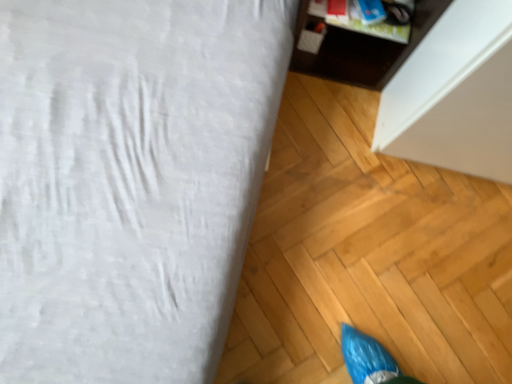
Question: In terms of height, does dark wood cabinet at upper right, which is the first furniture from right to left, look taller or shorter compared to white fabric bed at upper left, the first furniture positioned from the left?

Choices:
 (A) tall
 (B) short

Answer: (A)

Question: From the image's perspective, is dark wood cabinet at upper right, which is the first furniture from right to left, above or below white fabric bed at upper left, the first furniture positioned from the left?

Choices:
 (A) above
 (B) below

Answer: (A)

Question: Is dark wood cabinet at upper right, the 2th furniture when ordered from left to right, in front of or behind white fabric bed at upper left, which appears as the 2th furniture when viewed from the right, in the image?

Choices:
 (A) behind
 (B) front

Answer: (A)

Question: Is point (54, 309) positioned closer to the camera than point (446, 3)?

Choices:
 (A) closer
 (B) farther

Answer: (B)

Question: In terms of size, does white fabric bed at upper left, which appears as the 2th furniture when viewed from the right, appear bigger or smaller than dark wood cabinet at upper right, which is the first furniture from right to left?

Choices:
 (A) big
 (B) small

Answer: (A)

Question: From a real-world perspective, is white fabric bed at upper left, which appears as the 2th furniture when viewed from the right, positioned above or below dark wood cabinet at upper right, the 2th furniture when ordered from left to right?

Choices:
 (A) below
 (B) above

Answer: (A)

Question: Considering the positions of white fabric bed at upper left, the first furniture positioned from the left, and dark wood cabinet at upper right, the 2th furniture when ordered from left to right, in the image, is white fabric bed at upper left, the first furniture positioned from the left, taller or shorter than dark wood cabinet at upper right, the 2th furniture when ordered from left to right,?

Choices:
 (A) short
 (B) tall

Answer: (A)